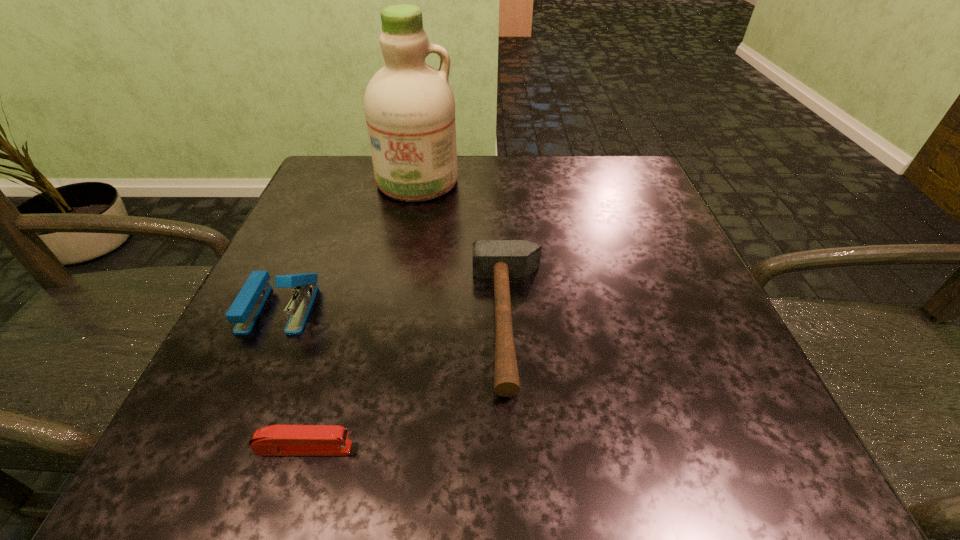
Locate an element on the screen. The width and height of the screenshot is (960, 540). free region located 0.130m on the striking surface of the rightmost object is located at coordinates (392, 320).

You are a GUI agent. You are given a task and a screenshot of the screen. Output one action in this format:
    pyautogui.click(x=<x>, y=<y>)
    Task: Click on the free spot located 0.210m on the striking surface of the rightmost object
    The image size is (960, 540).
    Given the screenshot: What is the action you would take?
    pyautogui.click(x=343, y=320)

This screenshot has height=540, width=960. Find the location of `vacant area situated 0.210m on the striking surface of the rightmost object`. vacant area situated 0.210m on the striking surface of the rightmost object is located at coordinates (343, 320).

At what (x,y) coordinates should I click in order to perform the action: click on vacant position located 0.390m on the front-facing side of the shortest object. Please return your answer as a coordinate pair (x, y). Looking at the image, I should click on (660, 448).

Locate an element on the screen. This screenshot has width=960, height=540. object positioned at the far edge is located at coordinates (409, 106).

Where is `object that is at the near edge`? Image resolution: width=960 pixels, height=540 pixels. object that is at the near edge is located at coordinates (277, 440).

Where is `cleansing agent that is at the left edge`? The height and width of the screenshot is (540, 960). cleansing agent that is at the left edge is located at coordinates pyautogui.click(x=409, y=106).

At what (x,y) coordinates should I click in order to perform the action: click on object that is at the far left corner. Please return your answer as a coordinate pair (x, y). Looking at the image, I should click on (409, 106).

I want to click on object that is at the near left corner, so click(277, 440).

Locate an element on the screen. This screenshot has width=960, height=540. vacant space at the far edge of the desktop is located at coordinates (484, 185).